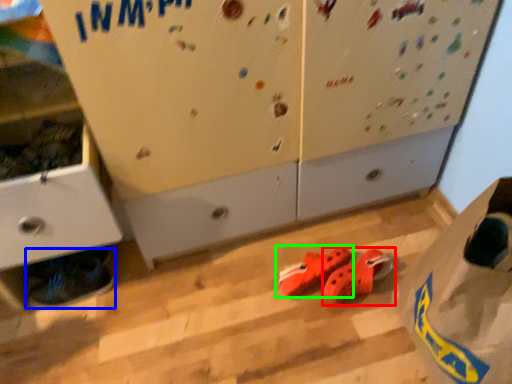
Question: Which is farther away from footwear (highlighted by a red box)? footwear (highlighted by a blue box) or footwear (highlighted by a green box)?

Choices:
 (A) footwear
 (B) footwear

Answer: (A)